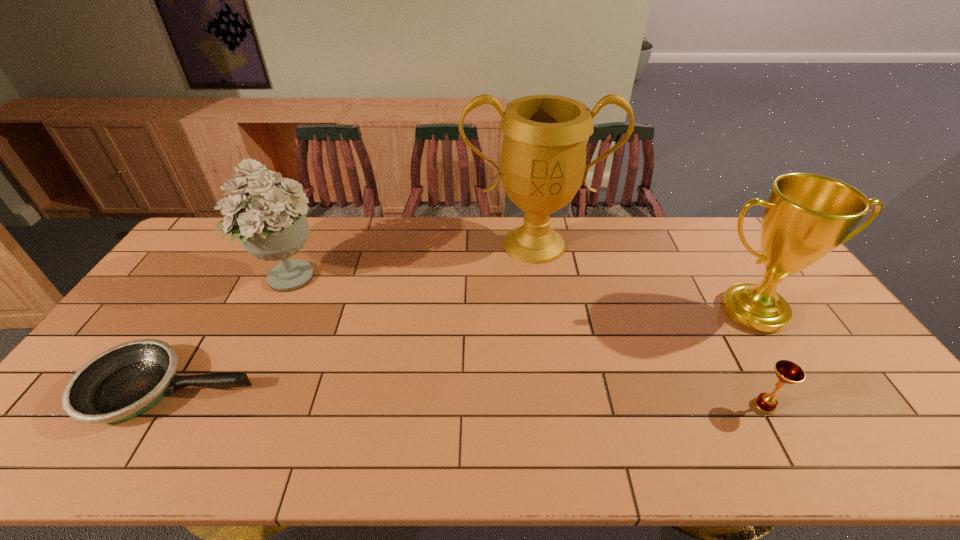
Locate an element on the screen. free space located 0.180m on the handle side of the frying pan is located at coordinates 324,389.

Find the location of a particular element. Image resolution: width=960 pixels, height=540 pixels. trophy that is positioned at the far edge is located at coordinates (543, 159).

Locate an element on the screen. bouquet that is positioned at the far edge is located at coordinates (272, 225).

Identify the location of object present at the near edge. Image resolution: width=960 pixels, height=540 pixels. (125, 381).

You are a GUI agent. You are given a task and a screenshot of the screen. Output one action in this format:
    pyautogui.click(x=<x>, y=<y>)
    Task: Click on the object that is positioned at the left edge
    This screenshot has width=960, height=540.
    Given the screenshot: What is the action you would take?
    pyautogui.click(x=125, y=381)

Where is `object situated at the right edge`? object situated at the right edge is located at coordinates click(x=806, y=216).

Locate an element on the screen. This screenshot has width=960, height=540. object at the near left corner is located at coordinates (125, 381).

Find the location of a particular element. The height and width of the screenshot is (540, 960). free space at the far edge is located at coordinates (348, 249).

In the image, there is a desktop. Where is `vacant space at the near edge`? The width and height of the screenshot is (960, 540). vacant space at the near edge is located at coordinates (374, 456).

This screenshot has height=540, width=960. In the image, there is a desktop. Identify the location of vacant space at the right edge. (829, 355).